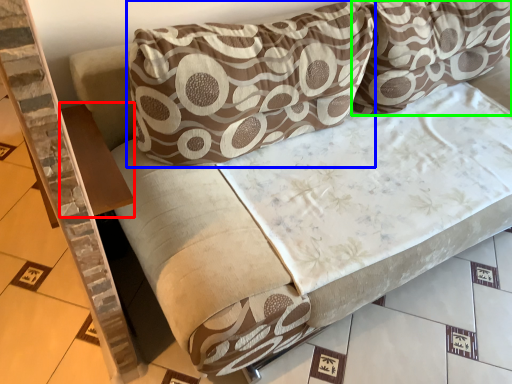
Question: Considering the real-world distances, which object is farthest from table (highlighted by a red box)? pillow (highlighted by a blue box) or pillow (highlighted by a green box)?

Choices:
 (A) pillow
 (B) pillow

Answer: (B)